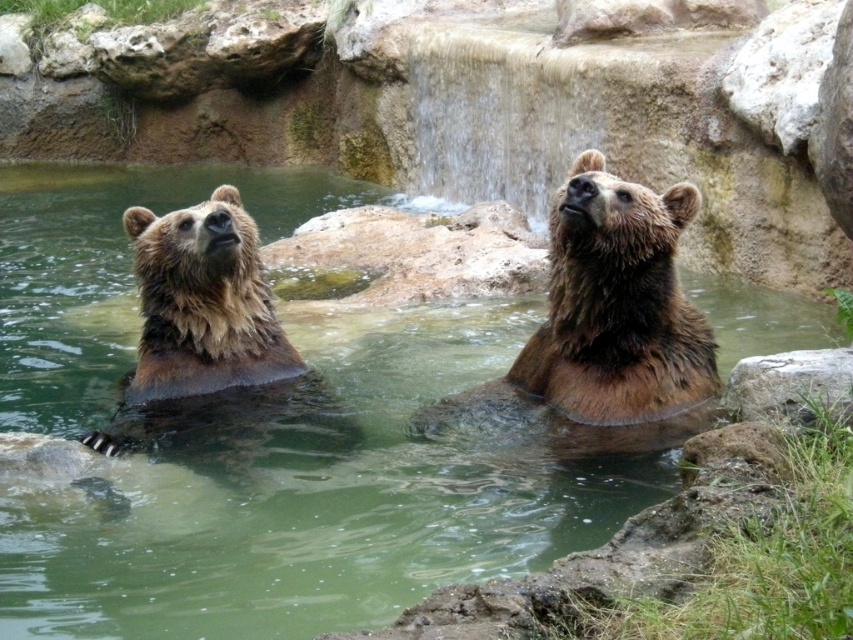
Question: Is green liquid water at center smaller than brown furry bear at left?

Choices:
 (A) no
 (B) yes

Answer: (A)

Question: Which object appears closest to the camera in this image?

Choices:
 (A) brown furry bear at center
 (B) green liquid water at center
 (C) brown furry bear at left

Answer: (B)

Question: Can you confirm if brown furry bear at center is thinner than brown furry bear at left?

Choices:
 (A) yes
 (B) no

Answer: (B)

Question: Which object appears closest to the camera in this image?

Choices:
 (A) brown furry bear at left
 (B) green liquid water at center

Answer: (B)

Question: Which of the following is the closest to the observer?

Choices:
 (A) (222, 196)
 (B) (677, 200)

Answer: (B)

Question: Is brown furry bear at center smaller than brown furry bear at left?

Choices:
 (A) no
 (B) yes

Answer: (A)